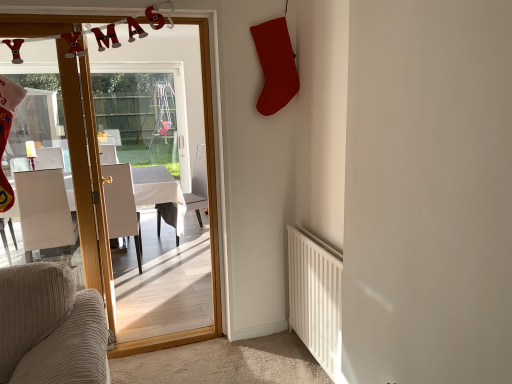
Question: Do you think white leather chair at left, acting as the second chair starting from the left, is within white glossy table at center, or outside of it?

Choices:
 (A) inside
 (B) outside

Answer: (A)

Question: From the image's perspective, is white leather chair at left, which appears as the 2th chair when viewed from the right, positioned above or below white glossy table at center?

Choices:
 (A) above
 (B) below

Answer: (A)

Question: Which of these objects is positioned closest to the white matte radiator at lower right?

Choices:
 (A) white glossy table at center
 (B) wooden glass door at center
 (C) white leather chair at left, acting as the second chair starting from the left
 (D) white leather chair at center, the 3th chair viewed from the left
 (E) white leather chair at left, the 1th chair when ordered from left to right

Answer: (B)

Question: Which is farther from the wooden glass door at center?

Choices:
 (A) white leather chair at center, which is the first chair from right to left
 (B) white leather chair at left, the 1th chair when ordered from left to right
 (C) white leather chair at left, which appears as the 2th chair when viewed from the right
 (D) white matte radiator at lower right
 (E) white glossy table at center

Answer: (A)